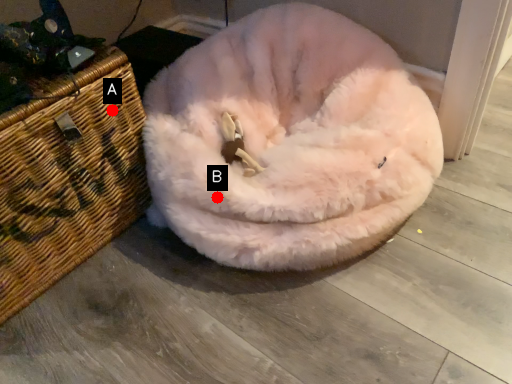
Question: Two points are circled on the image, labeled by A and B beside each circle. Among these points, which one is nearest to the camera?

Choices:
 (A) A is closer
 (B) B is closer

Answer: (B)